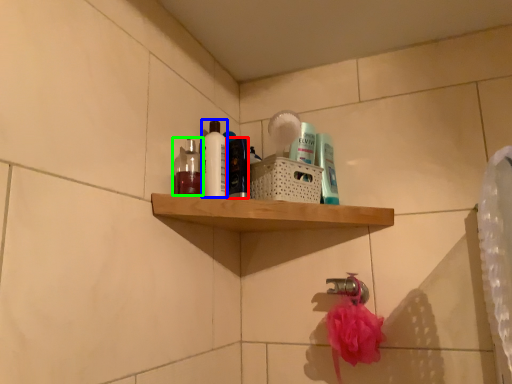
Question: Which object is the closest to the toiletry (highlighted by a red box)? Choose among these: cleaning product (highlighted by a blue box) or mouthwash (highlighted by a green box).

Choices:
 (A) cleaning product
 (B) mouthwash

Answer: (A)